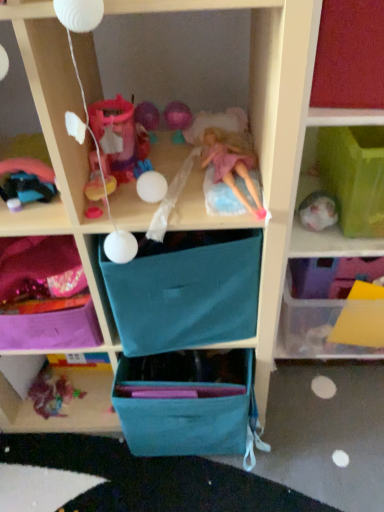
Question: Does point (241, 200) appear closer or farther from the camera than point (18, 180)?

Choices:
 (A) farther
 (B) closer

Answer: (B)

Question: Considering their positions, is pink fabric doll at center located in front of or behind shiny metallic car at left, the 2th toy from the bottom?

Choices:
 (A) front
 (B) behind

Answer: (B)

Question: Which is nearer to the transparent plastic container at right, the 3th shelf viewed from the left?

Choices:
 (A) teal fabric drawer at lower center, which is counted as the 1th drawer, starting from the bottom
 (B) purple fabric bag at lower left, arranged as the first shelf when viewed from the left
 (C) multicolored fabric toy at lower left, which ranks as the first toy in bottom-to-top order
 (D) translucent plastic container at right, which is the second shelf in left-to-right order
 (E) pink fabric doll at center

Answer: (D)

Question: Estimate the real-world distances between objects in this image. Which object is closer to the purple fabric bag at lower left, which appears as the 3th shelf when viewed from the right?

Choices:
 (A) pink fabric doll at center
 (B) shiny metallic car at left, arranged as the first toy when viewed from the front
 (C) teal fabric drawer at lower center, the second drawer when ordered from top to bottom
 (D) translucent plastic container at right, which is the second shelf in left-to-right order
 (E) transparent plastic container at right, which is the 1th shelf in right-to-left order

Answer: (B)